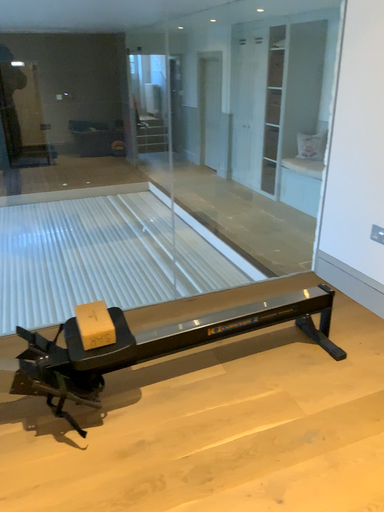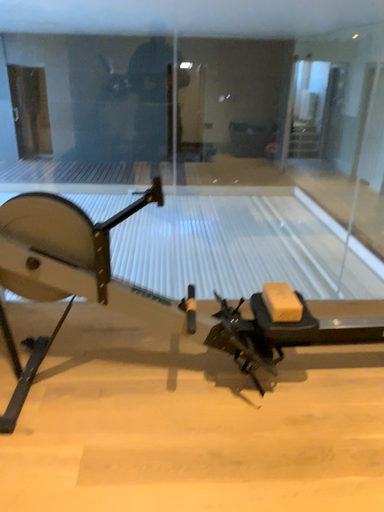
Question: How did the camera likely rotate when shooting the video?

Choices:
 (A) rotated right
 (B) rotated left

Answer: (B)